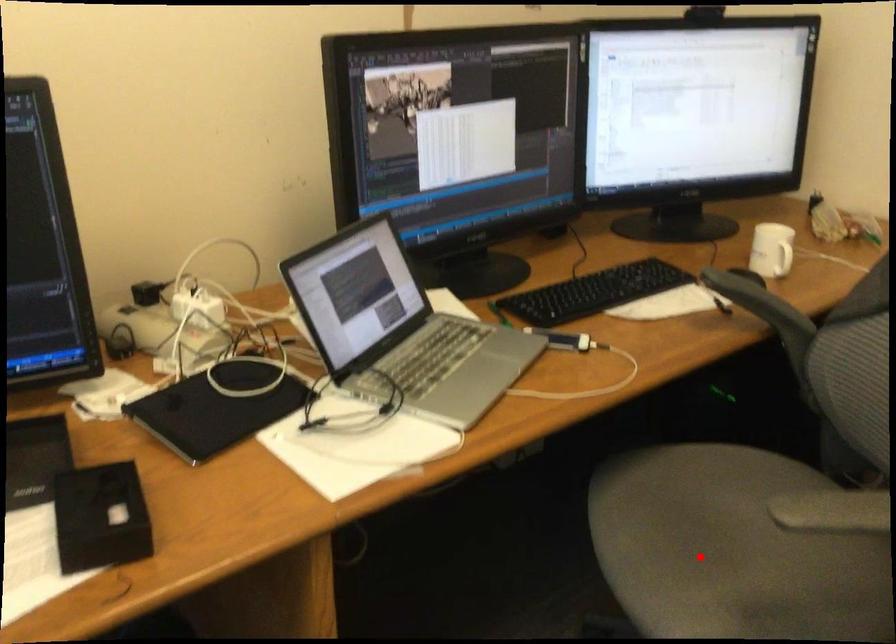
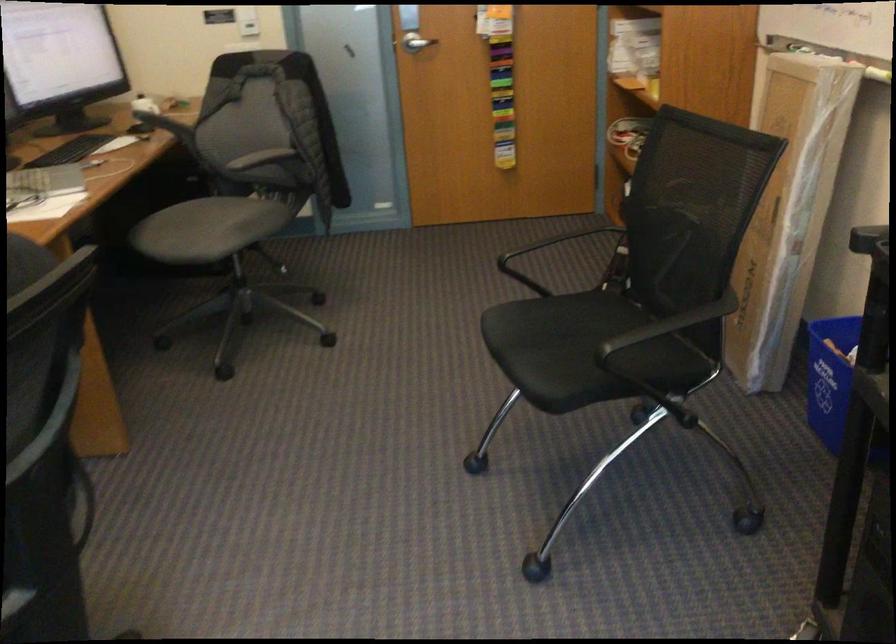
In the second image, find the point that corresponds to the highlighted location in the first image.

(207, 229)